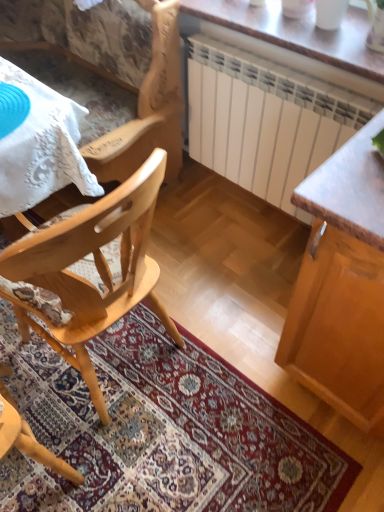
Identify the location of blank space above carpeted mat at center (from a real-world perspective). tap(142, 425).